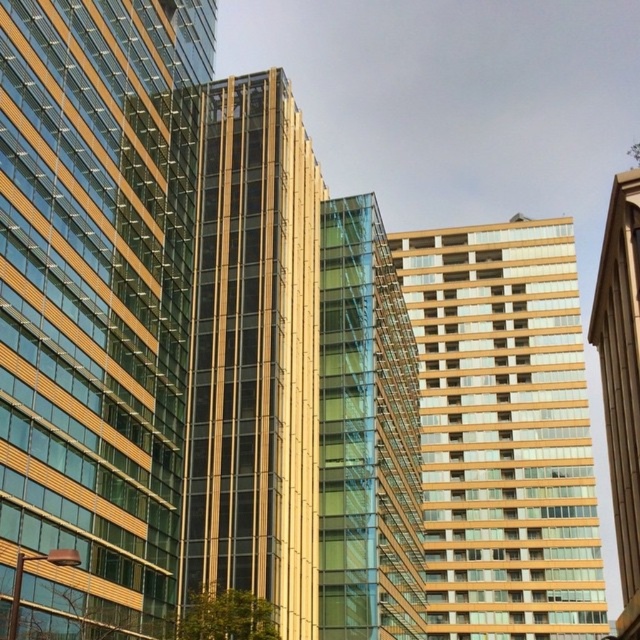
You are standing at the point marked as point (92, 298) in the image. Which building are you facing? Please answer with the exact object label from the scene description.

The point (92, 298) is where the matte glass building at center is located, so you are facing the matte glass building at center.

You are an architect analyzing the urban layout. Given that both the gold glass tower at center and the gold glass tower at right are part of a new development, which one would you recommend for a project requiring a more prominent visual impact in the skyline? Explain your reasoning based on their spatial characteristics.

The gold glass tower at right should be recommended for the project requiring a more prominent visual impact in the skyline because it occupies more space than the gold glass tower at center, making it stand out more in the urban landscape.